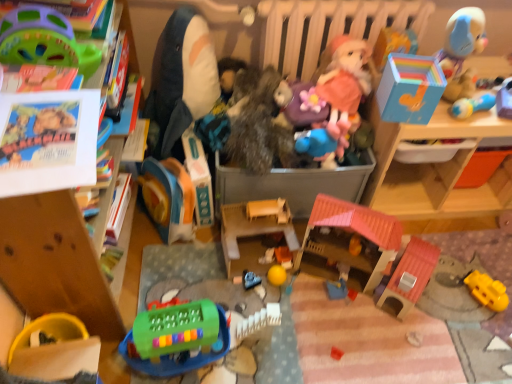
This screenshot has width=512, height=384. What are the coordinates of `free space to the back side of green plastic keyboard at lower left, the 5th toy viewed from the left` in the screenshot? It's located at (186, 279).